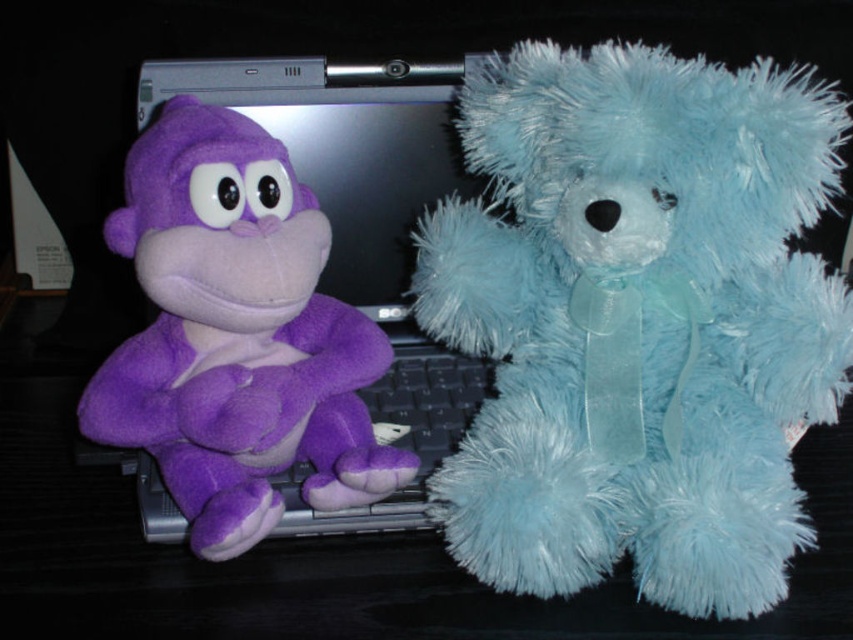
Question: Which of the following is the farthest from the observer?

Choices:
 (A) (718, 262)
 (B) (193, 424)
 (C) (439, 392)

Answer: (C)

Question: Does fuzzy light blue teddy bear at right appear under purple fabric keyboard at left?

Choices:
 (A) no
 (B) yes

Answer: (A)

Question: Considering the real-world distances, which object is farthest from the purple plush monkey at left?

Choices:
 (A) purple fabric keyboard at left
 (B) fuzzy light blue teddy bear at right

Answer: (B)

Question: Can you confirm if purple plush monkey at left is positioned to the right of purple fabric keyboard at left?

Choices:
 (A) no
 (B) yes

Answer: (A)

Question: Which point is closer to the camera?

Choices:
 (A) purple plush monkey at left
 (B) fuzzy light blue teddy bear at right
 (C) purple fabric keyboard at left

Answer: (B)

Question: Does fuzzy light blue teddy bear at right have a larger size compared to purple fabric keyboard at left?

Choices:
 (A) no
 (B) yes

Answer: (B)